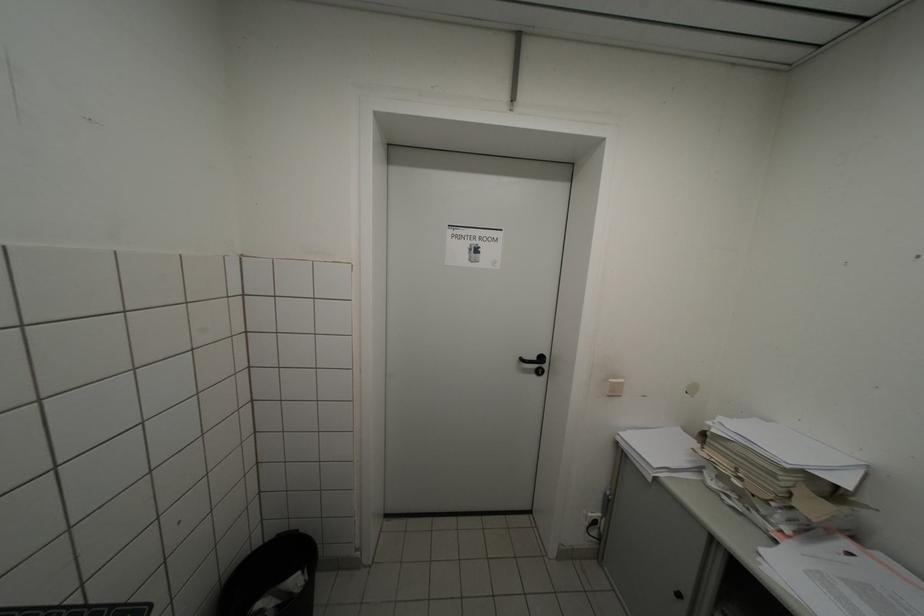
This screenshot has width=924, height=616. Identify the location of black door handle. (535, 363).